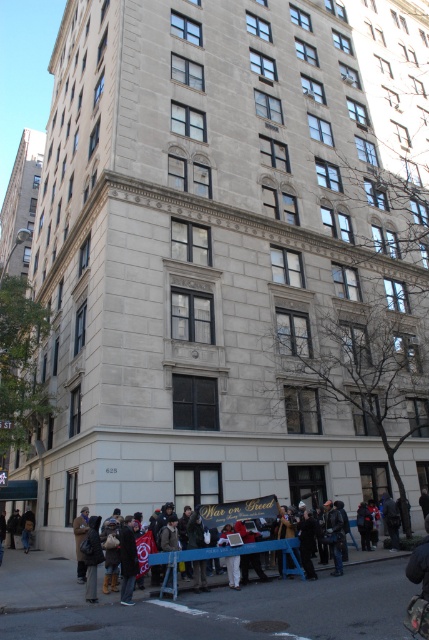
Question: Which object appears farthest from the camera in this image?

Choices:
 (A) white cotton shirt at lower center
 (B) dark brown leather jacket at lower left

Answer: (B)

Question: Which object is farther from the camera taking this photo?

Choices:
 (A) white cotton shirt at lower center
 (B) dark brown leather jacket at lower left

Answer: (B)

Question: Does white cotton shirt at lower center appear on the left side of dark brown leather jacket at lower left?

Choices:
 (A) yes
 (B) no

Answer: (B)

Question: Can you confirm if white cotton shirt at lower center is positioned to the left of dark brown leather jacket at lower left?

Choices:
 (A) yes
 (B) no

Answer: (B)

Question: Is white cotton shirt at lower center positioned at the back of dark brown leather jacket at lower left?

Choices:
 (A) yes
 (B) no

Answer: (B)